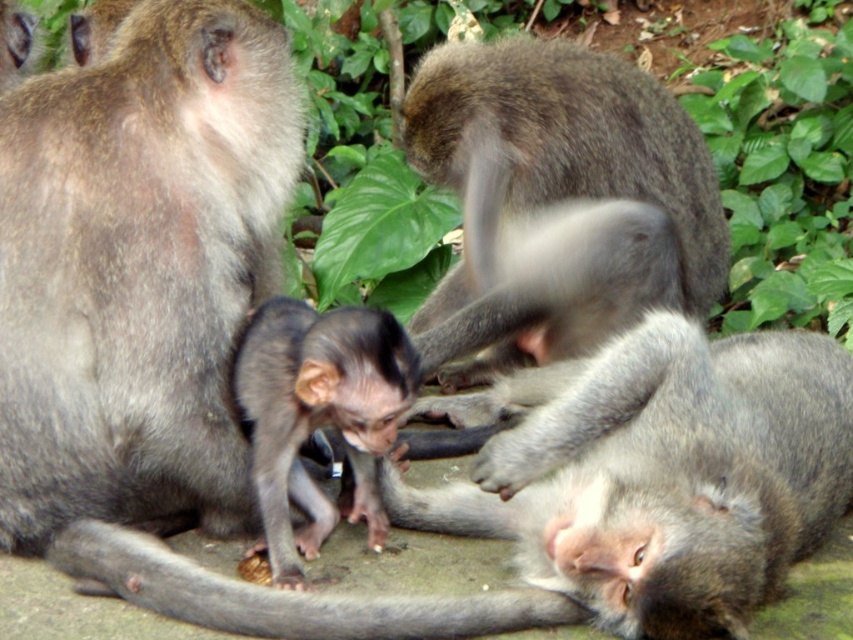
Question: Which point is farther from the camera taking this photo?

Choices:
 (A) [x=517, y=269]
 (B) [x=267, y=454]

Answer: (A)

Question: Does gray furry monkey at upper center come in front of dark gray fur monkey at center?

Choices:
 (A) no
 (B) yes

Answer: (A)

Question: Which of the following is the farthest from the observer?

Choices:
 (A) gray fur monkey at lower right
 (B) dark gray fur monkey at center

Answer: (B)

Question: In this image, where is gray furry monkey at upper center located relative to dark gray fur monkey at center?

Choices:
 (A) above
 (B) below

Answer: (A)

Question: Is gray fur monkey at lower right wider than gray furry monkey at upper center?

Choices:
 (A) no
 (B) yes

Answer: (B)

Question: Among these points, which one is nearest to the camera?

Choices:
 (A) (288, 301)
 (B) (850, 420)
 (C) (560, 189)

Answer: (B)